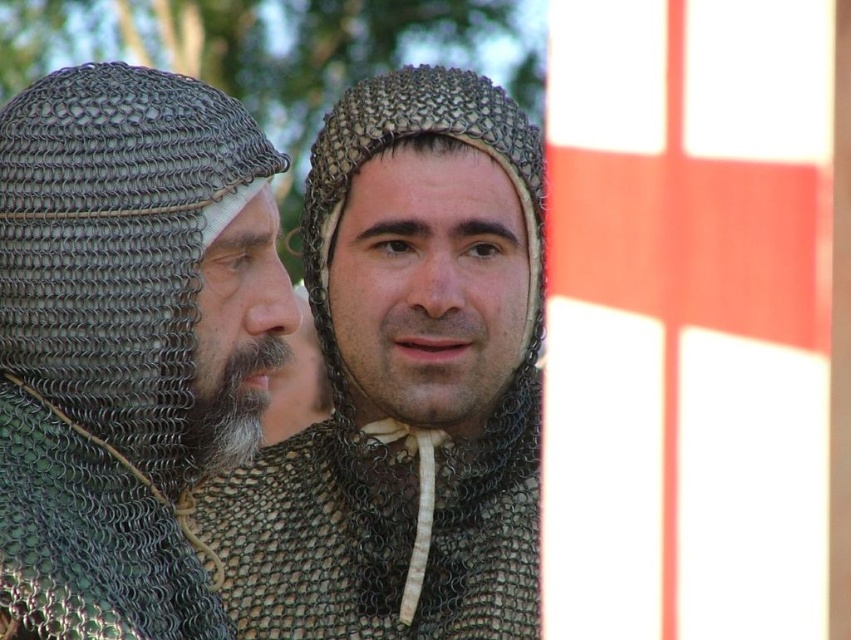
You are a medieval knight preparing to join a tournament. You have two chainmail helmets available in the image. Which one is bigger between the chainmail helmet at center and the chainmail helmet at left?

The chainmail helmet at center has a larger size compared to the chainmail helmet at left, so the chainmail helmet at center is bigger.

You are a knight standing 5 meters away from the chainmail helmet at center. Can you safely pick it up without moving closer?

The chainmail helmet at center is 4.90 meters away from the viewer. Since you are standing 5 meters away, you are slightly farther than the helmet, so you cannot safely reach it without moving closer.

You are a medieval knight standing in the scene and need to locate your dropped chainmail helmet at center. Based on the coordinates provided, where should you look relative to your current position at point 0.5?

The chainmail helmet at center is located at point 0.598, which is to the right of your current position at point 0.5.